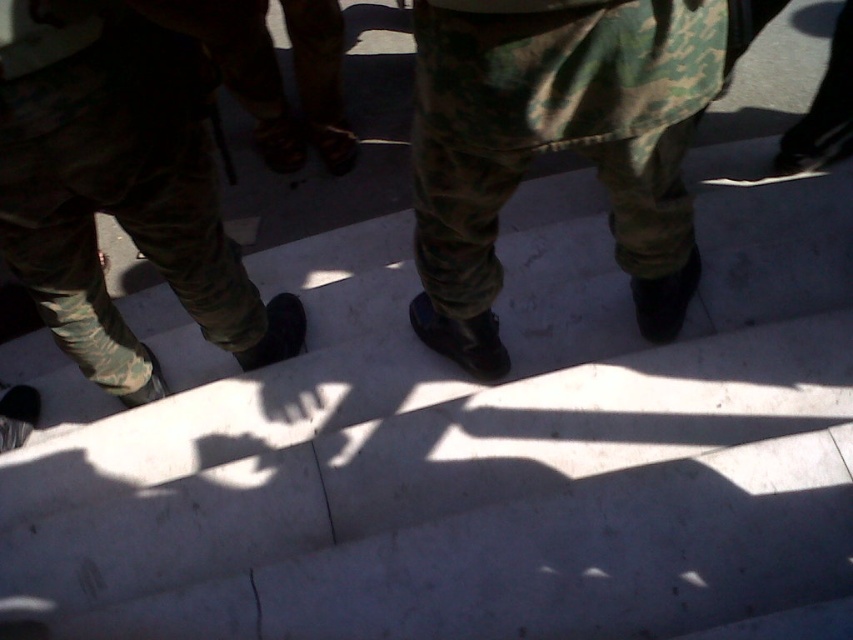
Question: Can you confirm if camouflage pants at center is positioned to the left of camouflage pants at left?

Choices:
 (A) no
 (B) yes

Answer: (A)

Question: Which point is closer to the camera?

Choices:
 (A) camouflage pants at center
 (B) camouflage pants at left

Answer: (A)

Question: Does camouflage pants at center appear on the right side of camouflage pants at left?

Choices:
 (A) no
 (B) yes

Answer: (B)

Question: Can you confirm if camouflage pants at center is positioned to the right of camouflage pants at left?

Choices:
 (A) no
 (B) yes

Answer: (B)

Question: Which object appears farthest from the camera in this image?

Choices:
 (A) camouflage pants at left
 (B) camouflage pants at center

Answer: (A)